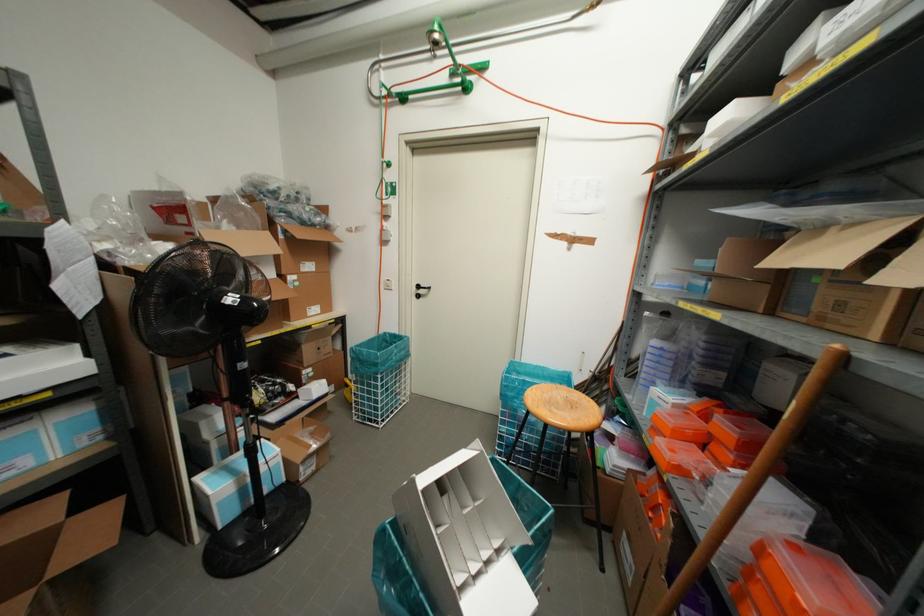
In order to click on cardboard box in this screenshot , I will do `click(744, 253)`.